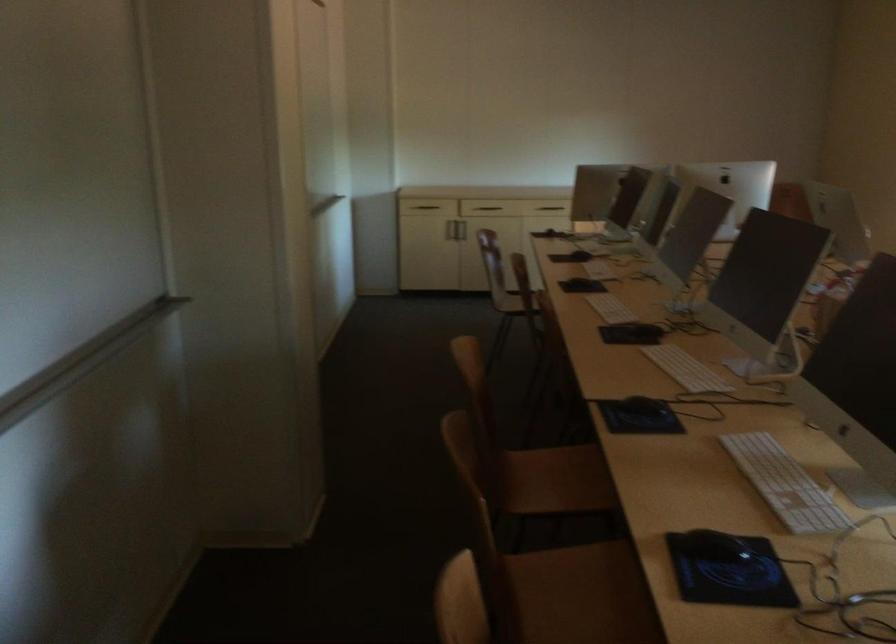
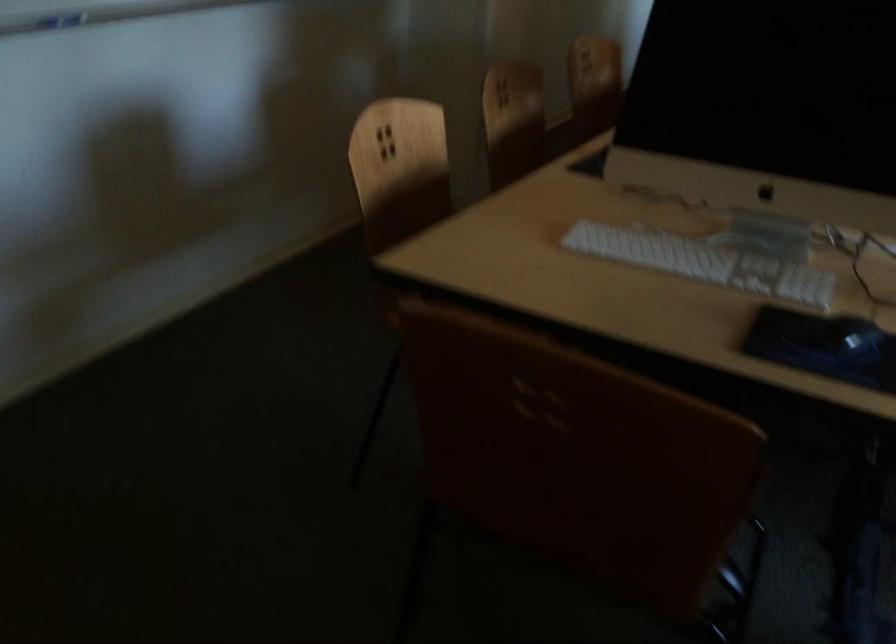
Question: I am providing you with two images of the same scene from different viewpoints. After the viewpoint changes to image2, which objects are now occluded?

Choices:
 (A) white computer keyboard
 (B) colorful woven pad
 (C) black computer mouse
 (D) white keyboard

Answer: (A)